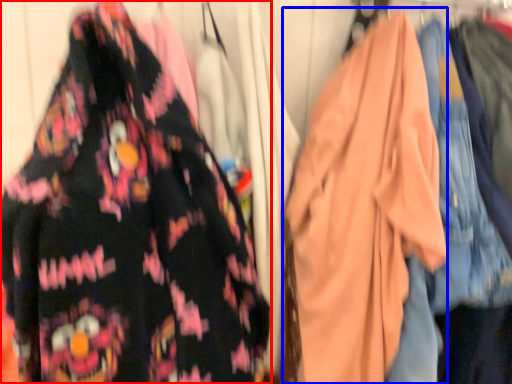
Question: Which point is further to the camera, fancy dress (highlighted by a red box) or garment (highlighted by a blue box)?

Choices:
 (A) fancy dress
 (B) garment

Answer: (B)